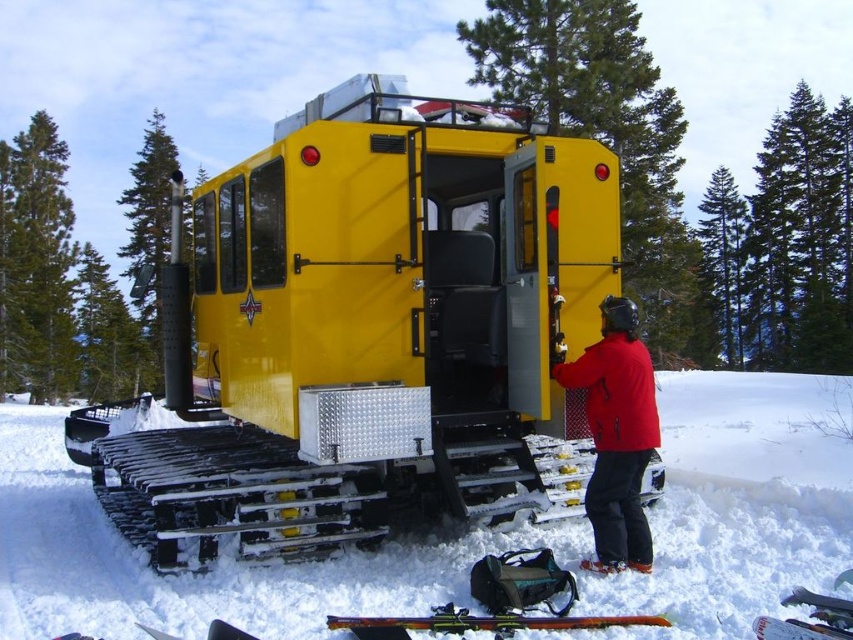
You are a maintenance worker needing to access the open door of the snowcat. From your current position, which object is nearer to you between the white powdery snow at center and the red matte jacket at center?

The white powdery snow at center is closer to the viewer than the red matte jacket at center, so the snow is nearer.

You are a worker who needs to move a tool from the yellow metallic train car at center to the red matte jacket at center. Considering their sizes, will the tool fit through the space between them?

The yellow metallic train car at center is narrower than the red matte jacket at center, so the space between them is sufficient for the tool to pass through.